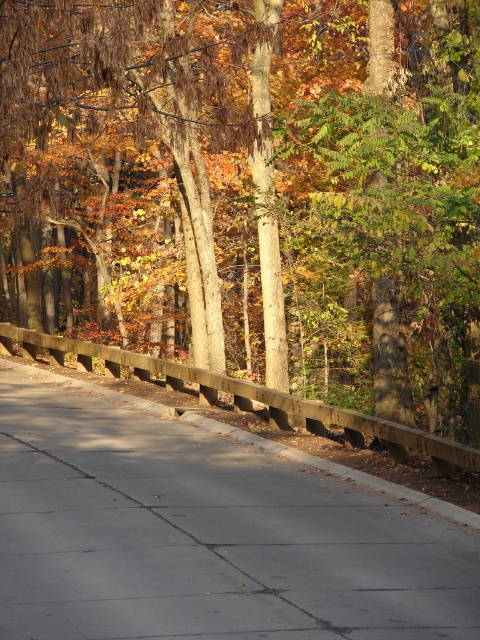
Which is above, brown wooden fence at center or concrete at center?

brown wooden fence at center

Is brown wooden fence at center bigger than concrete at center?

Yes.

Who is more distant from viewer, (83, 157) or (12, 525)?

Positioned behind is point (83, 157).

The height and width of the screenshot is (640, 480). I want to click on brown wooden fence at center, so click(255, 188).